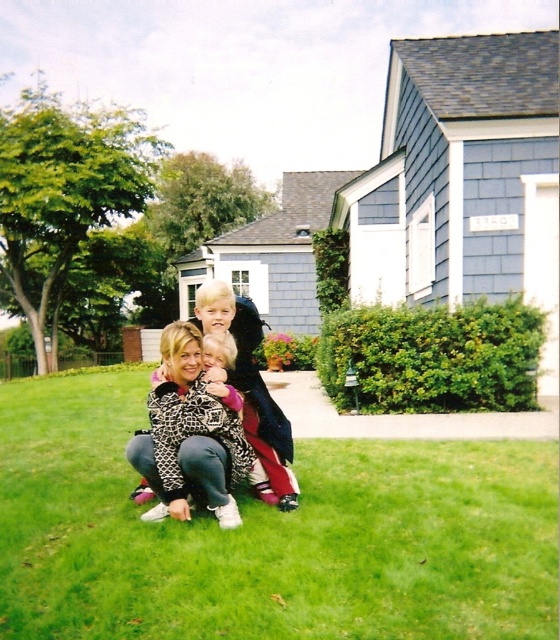
Question: Is green grass at lower center further to the viewer compared to leopard print jacket at center?

Choices:
 (A) no
 (B) yes

Answer: (A)

Question: Is green grass at lower center wider than leopard print jacket at center?

Choices:
 (A) yes
 (B) no

Answer: (A)

Question: Can you confirm if green grass at lower center is positioned to the left of leopard print jacket at center?

Choices:
 (A) no
 (B) yes

Answer: (B)

Question: Which point is closer to the camera?

Choices:
 (A) (124, 563)
 (B) (290, 486)

Answer: (A)